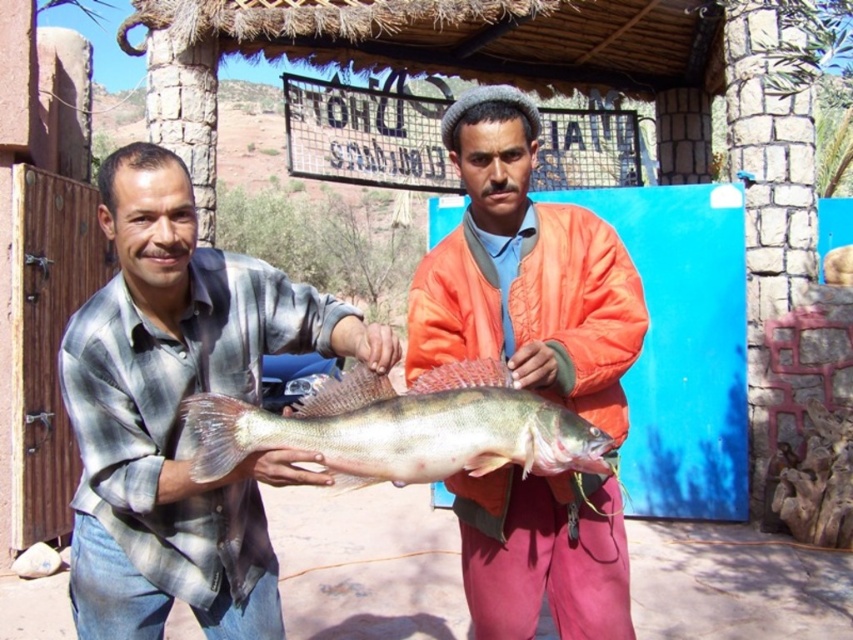
You are standing 5 feet away from the plaid shirt at center. Can you reach it without moving closer?

The plaid shirt at center is 6.96 feet away from the viewer. Since you are standing 5 feet away from it, you can reach it without moving closer because you are already within the 6.96 feet distance.

You are a photographer trying to capture a photo of the two men holding the fish. You want to ensure that both points, point (386, 326) and point (445, 314), are visible in the frame. Based on their positions, which point should be closer to the camera?

Point (386, 326) is in front of point (445, 314), so it should be closer to the camera.